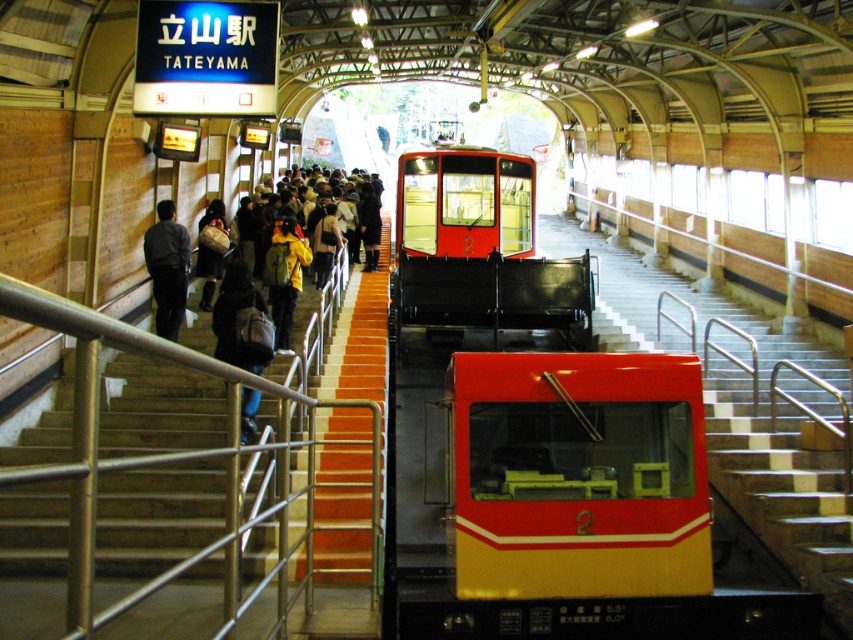
You are standing at the station platform at Tateyama Station and want to move from point A to point B. Point A is located at coordinates point (643, 317) and point B is at point (328, 252). Which point is closer to you when you start moving?

Point (643, 317) is closer to the viewer than point (328, 252), so you will start moving from the closer point A.

You are a person carrying a large suitcase that is 1.2 meters wide. You need to walk from the upper level to the lower platform where the matte black train at center is located. Can you pass through the wooden staircase at center without moving the suitcase sideways?

The wooden staircase at center is wider than the matte black train at center. However, the width comparison between the staircase and the suitcase isn not provided. Therefore, it is uncertain if the staircase can accommodate the 1.2 meter wide suitcase without moving it sideways.

You are standing on the Tateyama Station platform and notice the wooden staircase at center and the matte black train at center. Which object is taller?

The wooden staircase at center is taller than the matte black train at center.